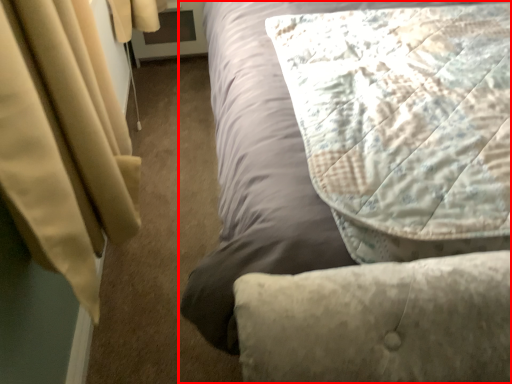
Question: Where is bed (annotated by the red box) located in relation to pillow in the image?

Choices:
 (A) left
 (B) right

Answer: (B)